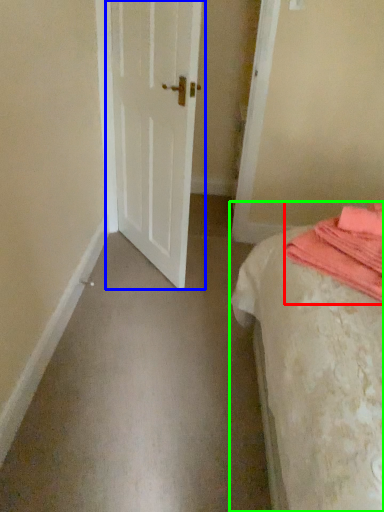
Question: Based on their relative distances, which object is farther from blanket (highlighted by a red box)? Choose from door (highlighted by a blue box) and bed (highlighted by a green box).

Choices:
 (A) door
 (B) bed

Answer: (A)